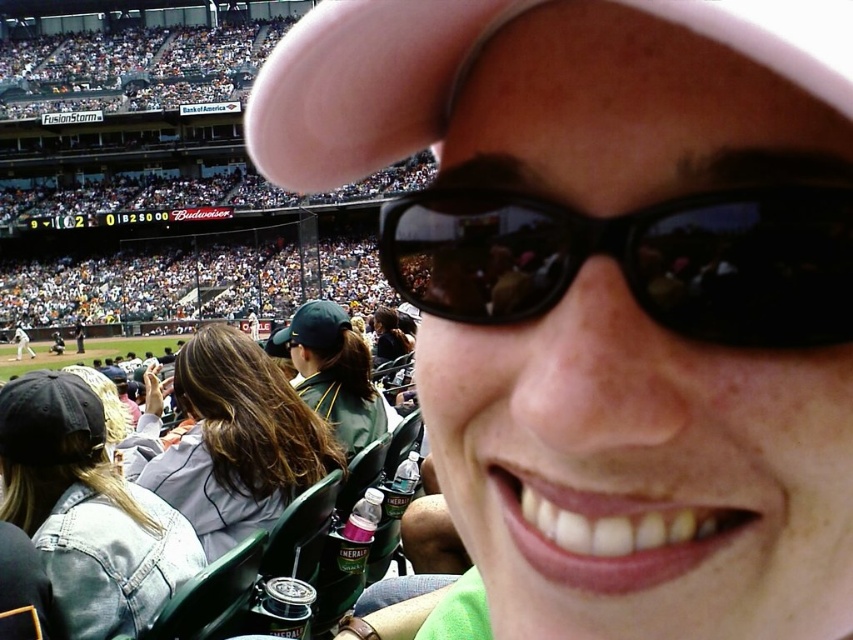
Measure the distance between green jersey at center and black fabric cap at lower left.

They are 48.98 feet apart.

Find the location of a particular element. This screenshot has height=640, width=853. green jersey at center is located at coordinates (334, 372).

Who is more distant from viewer, (323,403) or (64,461)?

Positioned behind is point (323,403).

Identify the location of green jersey at center. This screenshot has width=853, height=640. (334, 372).

Does black plastic sunglasses at center have a greater width compared to green jersey at center?

Yes.

You are a GUI agent. You are given a task and a screenshot of the screen. Output one action in this format:
    pyautogui.click(x=<x>, y=<y>)
    Task: Click on the black plastic sunglasses at center
    The width and height of the screenshot is (853, 640).
    Given the screenshot: What is the action you would take?
    pyautogui.click(x=634, y=259)

Is black plastic sunglasses at center wider than denim jacket at lower left?

Correct, the width of black plastic sunglasses at center exceeds that of denim jacket at lower left.

Who is shorter, black plastic sunglasses at center or denim jacket at lower left?

denim jacket at lower left is shorter.

Between point (850, 301) and point (108, 598), which one is positioned behind?

The point (108, 598) is behind.

The image size is (853, 640). Identify the location of black plastic sunglasses at center. (634, 259).